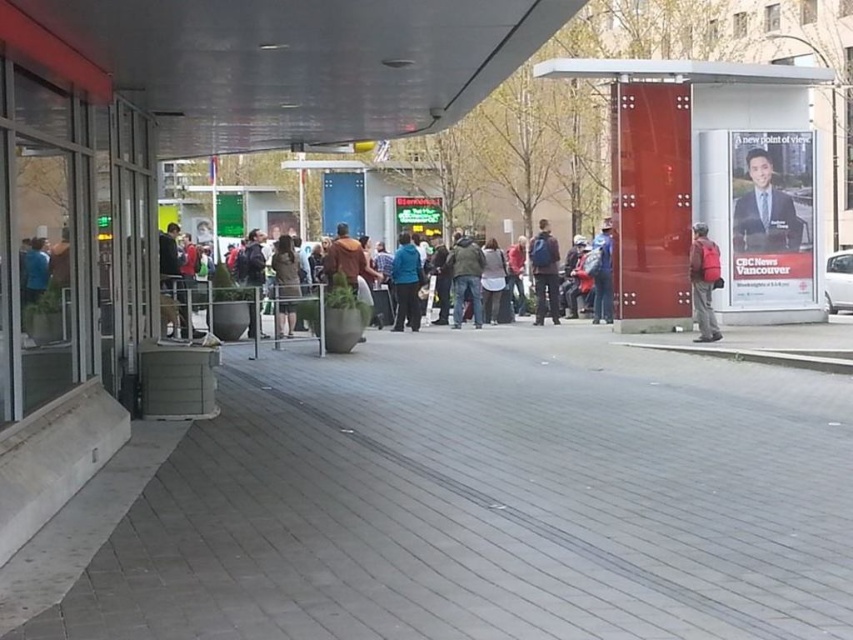
Which is behind, point (788, 236) or point (492, 250)?

The point (492, 250) is more distant.

Which is more to the left, smooth suit at center or white matte jacket at center?

white matte jacket at center is more to the left.

Does point (753, 224) come closer to viewer compared to point (486, 284)?

Yes.

Locate an element on the screen. The width and height of the screenshot is (853, 640). smooth suit at center is located at coordinates (764, 211).

What do you see at coordinates (357, 257) in the screenshot?
I see `multicolored casual clothing at center` at bounding box center [357, 257].

Can you confirm if multicolored casual clothing at center is wider than matte red backpack at right?

Yes.

Who is more forward, (360,241) or (704,244)?

Point (704,244)

What are the coordinates of `multicolored casual clothing at center` in the screenshot? It's located at (357, 257).

Is the position of smooth suit at center more distant than that of matte red backpack at right?

Yes, it is.

Which of these two, smooth suit at center or matte red backpack at right, stands taller?

smooth suit at center

Does point (735, 208) come farther from viewer compared to point (712, 260)?

That is True.

Locate an element on the screen. The image size is (853, 640). smooth suit at center is located at coordinates (764, 211).